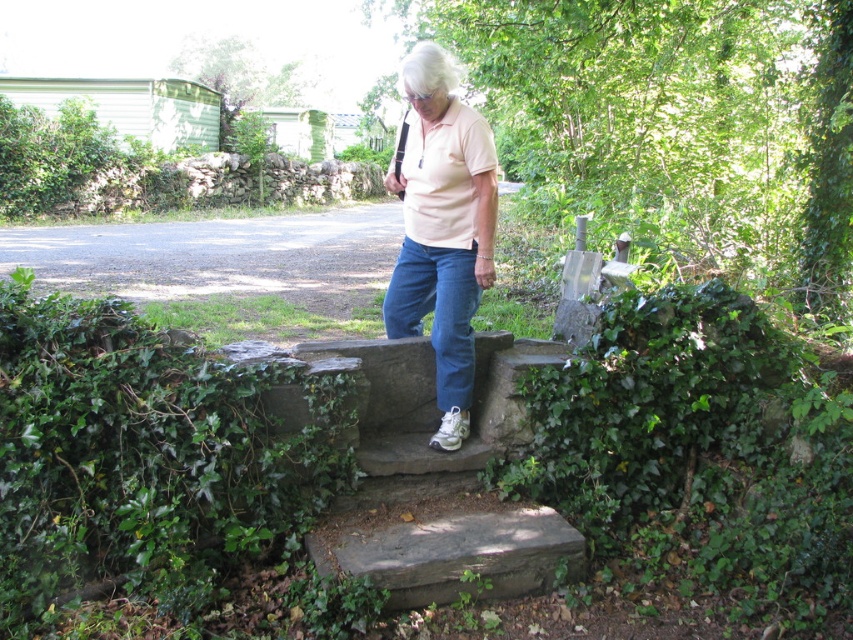
You are standing at the camera position and want to reach the point marked at coordinates (401, 428). The path is clear except for a small stream flowing across it. If your walking speed is 1.5 meters per second, how many seconds will it take you to reach the point?

The distance between you and the point marked at coordinates (401, 428) is 3.70 meters. At a speed of 1.5 meters per second, it would take approximately 2.47 seconds to reach the point.